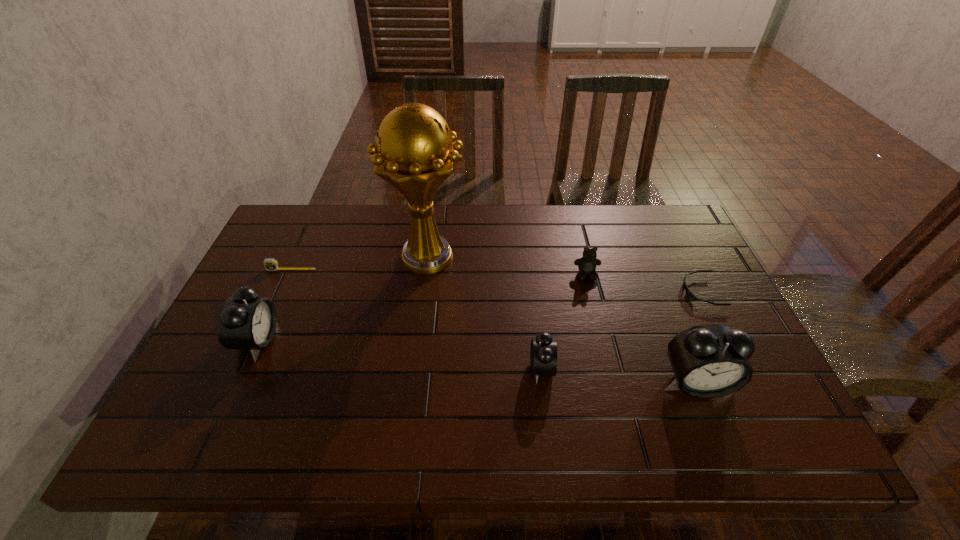
The width and height of the screenshot is (960, 540). I want to click on blank space at the far left corner of the desktop, so click(324, 212).

In the image, there is a desktop. Where is `vacant space at the far right corner`? This screenshot has width=960, height=540. vacant space at the far right corner is located at coordinates (636, 207).

At what (x,y) coordinates should I click in order to perform the action: click on blank region between the shortest object and the trophy_cup. Please return your answer as a coordinate pair (x, y). The width and height of the screenshot is (960, 540). Looking at the image, I should click on (564, 275).

This screenshot has width=960, height=540. I want to click on blank region between the tape measure and the rightmost alarm clock, so click(x=493, y=326).

Where is `empty location between the second shortest alarm clock and the fourth object from left to right`? empty location between the second shortest alarm clock and the fourth object from left to right is located at coordinates click(x=399, y=355).

Where is `free space between the fifth shortest object and the sixth tallest object`? Image resolution: width=960 pixels, height=540 pixels. free space between the fifth shortest object and the sixth tallest object is located at coordinates (275, 305).

You are a GUI agent. You are given a task and a screenshot of the screen. Output one action in this format:
    pyautogui.click(x=<x>, y=<y>)
    Task: Click on the unoccupied area between the trophy_cup and the teddy bear
    The image size is (960, 540).
    Given the screenshot: What is the action you would take?
    pyautogui.click(x=507, y=267)

This screenshot has width=960, height=540. I want to click on free spot between the leftmost alarm clock and the rightmost alarm clock, so click(476, 362).

Find the location of a particular element. Image resolution: width=960 pixels, height=540 pixels. vacant space that is in between the sunglasses and the fifth object from left to right is located at coordinates (644, 283).

Locate an element on the screen. Image resolution: width=960 pixels, height=540 pixels. free space that is in between the rightmost alarm clock and the fifth object from right to left is located at coordinates (562, 321).